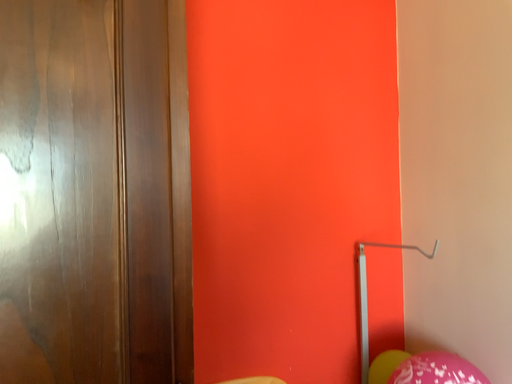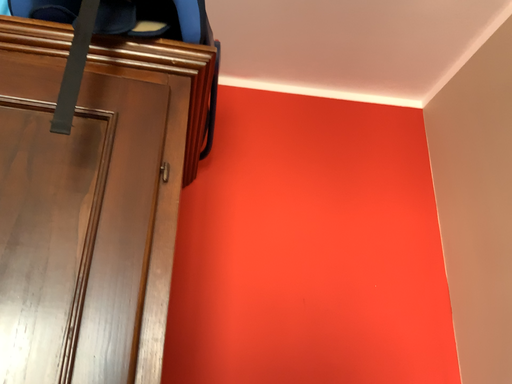
Question: Which way did the camera rotate in the video?

Choices:
 (A) rotated downward
 (B) rotated upward

Answer: (B)